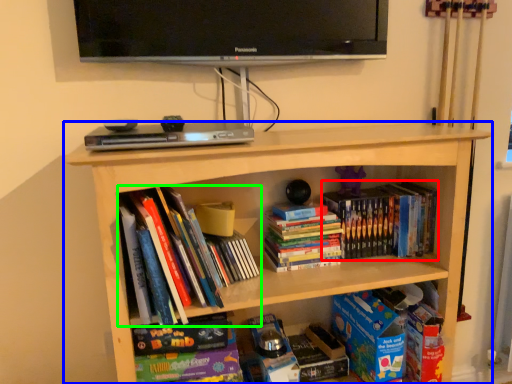
Question: Which object is the closest to the book (highlighted by a red box)? Choose among these: bookcase (highlighted by a blue box) or book (highlighted by a green box).

Choices:
 (A) bookcase
 (B) book

Answer: (A)